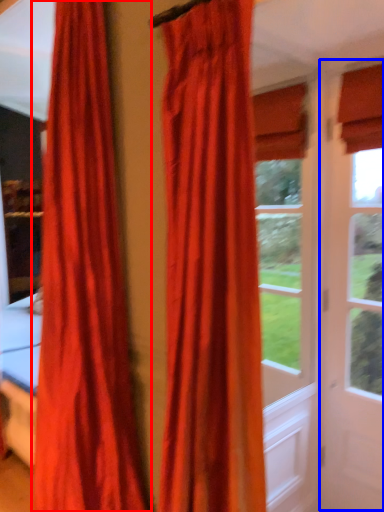
Question: Among these objects, which one is farthest to the camera, curtain (highlighted by a red box) or screen door (highlighted by a blue box)?

Choices:
 (A) curtain
 (B) screen door

Answer: (B)